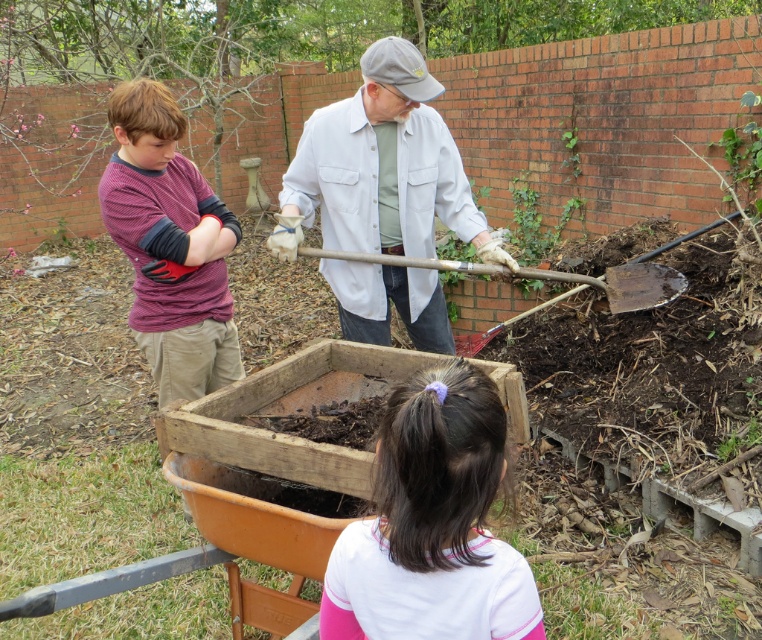
Question: Is pink fabric ponytail at lower center to the right of green leafy plant at upper right from the viewer's perspective?

Choices:
 (A) no
 (B) yes

Answer: (A)

Question: Among these points, which one is nearest to the camera?

Choices:
 (A) 319,625
 (B) 756,208

Answer: (A)

Question: Estimate the real-world distances between objects in this image. Which object is farther from the pink fabric ponytail at lower center?

Choices:
 (A) striped cotton shirt at left
 (B) green leafy plant at upper right
 (C) wooden shovel at center

Answer: (B)

Question: Can you confirm if wooden shovel at center is positioned to the right of green leafy plant at upper right?

Choices:
 (A) yes
 (B) no

Answer: (B)

Question: Among these objects, which one is farthest from the camera?

Choices:
 (A) striped cotton shirt at left
 (B) green leafy plant at upper right

Answer: (B)

Question: Is striped cotton shirt at left to the left of green leafy plant at upper right from the viewer's perspective?

Choices:
 (A) no
 (B) yes

Answer: (B)